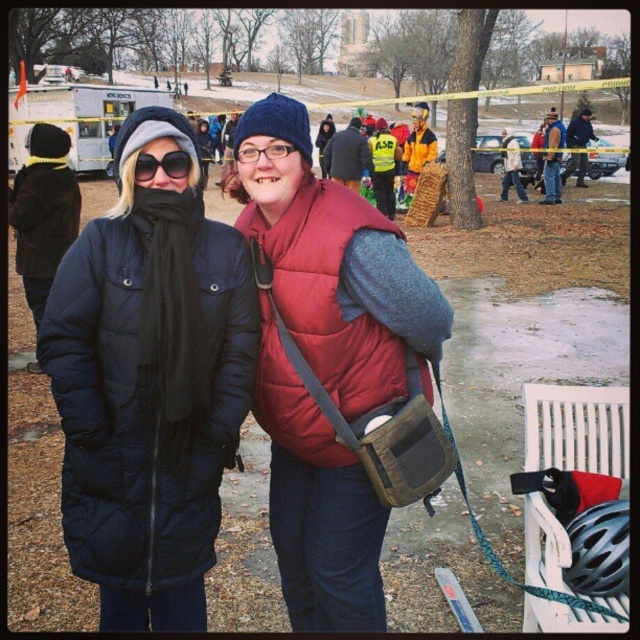
You are standing in a park and see the matte blue jacket at center. If you want to reach it in 3 seconds, what is the minimum speed you need to walk at?

To cover 18.09 meters in 3 seconds, you would need to walk at a minimum speed of approximately 6.03 meters per second.

You are taking a photo of two people in the park. You want to ensure the matte black coat at center and the dark blue jacket at center are both in frame. Based on their positions, which one should you adjust your camera to focus on first to capture both?

The matte black coat at center is to the left of the dark blue jacket at center. To capture both in frame, focus on the matte black coat at center first as it is on the left side, then adjust to include the dark blue jacket at center on the right.

You are trying to decide which jacket to choose for a cold day based on the image. The red jacket at center and the matte blue jacket at center are both options. Which jacket would you say is shorter in height?

The red jacket at center is not as tall as matte blue jacket at center, so the red jacket at center is shorter in height.